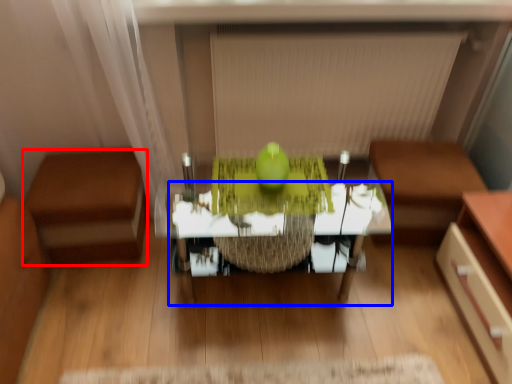
Question: Which object is further to the camera taking this photo, furniture (highlighted by a red box) or table (highlighted by a blue box)?

Choices:
 (A) furniture
 (B) table

Answer: (A)